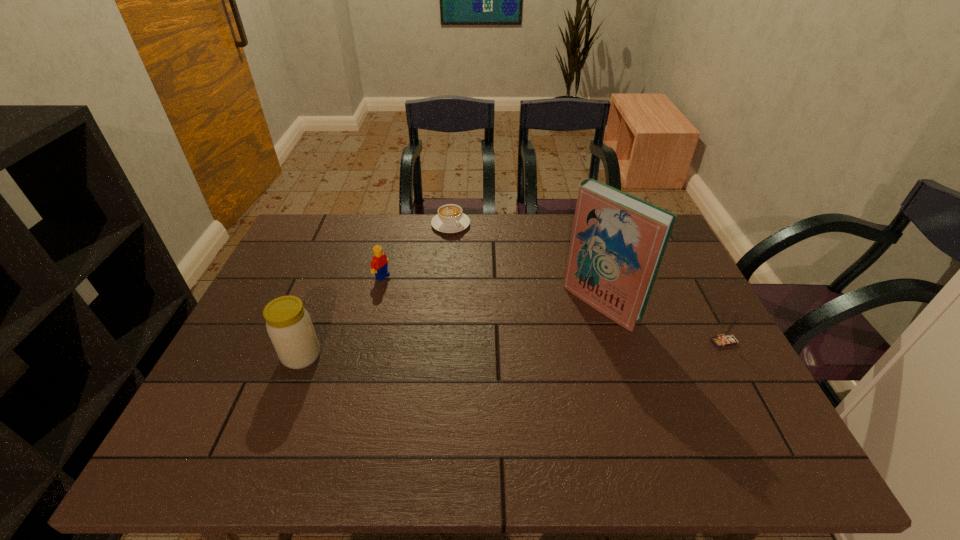
Where is `free spot between the third object from left to right and the jar`? This screenshot has height=540, width=960. free spot between the third object from left to right and the jar is located at coordinates (376, 290).

Locate an element on the screen. The width and height of the screenshot is (960, 540). blank region between the hardback book and the cappuccino is located at coordinates (526, 264).

Where is `free space between the second object from left to right and the leftmost object`? The image size is (960, 540). free space between the second object from left to right and the leftmost object is located at coordinates (342, 316).

The image size is (960, 540). Identify the location of free spot between the jar and the shortest object. (376, 290).

This screenshot has height=540, width=960. I want to click on free spot between the rightmost object and the second object from left to right, so click(553, 309).

You are a GUI agent. You are given a task and a screenshot of the screen. Output one action in this format:
    pyautogui.click(x=<x>, y=<y>)
    Task: Click on the free space between the farthest object and the jar
    Image resolution: width=960 pixels, height=540 pixels.
    Given the screenshot: What is the action you would take?
    pyautogui.click(x=376, y=290)

Identify which object is the fourth nearest to the hardback book. Please provide its 2D coordinates. Your answer should be formatted as a tuple, i.e. [(x, y)], where the tuple contains the x and y coordinates of a point satisfying the conditions above.

[(289, 326)]

Locate which object is the third closest to the tallest object. Please provide its 2D coordinates. Your answer should be formatted as a tuple, i.e. [(x, y)], where the tuple contains the x and y coordinates of a point satisfying the conditions above.

[(379, 262)]

Find the location of `free spot that satisfies the following two spatial constraints: 1. on the front side of the tallest object; 2. on the right side of the cappuccino`. free spot that satisfies the following two spatial constraints: 1. on the front side of the tallest object; 2. on the right side of the cappuccino is located at coordinates (444, 303).

Locate an element on the screen. blank space that satisfies the following two spatial constraints: 1. on the front side of the fourth object from left to right; 2. on the right side of the third object from right to left is located at coordinates (444, 303).